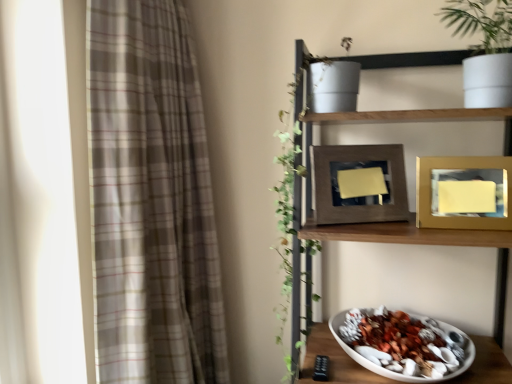
Question: From a real-world perspective, is plaid fabric curtain at left below wooden shelf at upper right?

Choices:
 (A) no
 (B) yes

Answer: (A)

Question: Is wooden shelf at upper right located within plaid fabric curtain at left?

Choices:
 (A) yes
 (B) no

Answer: (B)

Question: From a real-world perspective, is plaid fabric curtain at left on top of wooden shelf at upper right?

Choices:
 (A) yes
 (B) no

Answer: (A)

Question: Considering the relative sizes of plaid fabric curtain at left and wooden shelf at upper right in the image provided, is plaid fabric curtain at left smaller than wooden shelf at upper right?

Choices:
 (A) yes
 (B) no

Answer: (A)

Question: Is plaid fabric curtain at left placed right next to wooden shelf at upper right?

Choices:
 (A) yes
 (B) no

Answer: (B)

Question: Is point (422, 324) positioned closer to the camera than point (434, 205)?

Choices:
 (A) closer
 (B) farther

Answer: (B)

Question: Is white matte bowl at lower right inside the boundaries of gold metallic picture frame at upper right, which is the second picture frame in left-to-right order, or outside?

Choices:
 (A) inside
 (B) outside

Answer: (B)

Question: Considering the positions of white matte bowl at lower right and gold metallic picture frame at upper right, which is the second picture frame in left-to-right order, in the image, is white matte bowl at lower right taller or shorter than gold metallic picture frame at upper right, which is the second picture frame in left-to-right order,?

Choices:
 (A) tall
 (B) short

Answer: (B)

Question: In the image, is white matte bowl at lower right positioned in front of or behind gold metallic picture frame at upper right, which ranks as the 1th picture frame in right-to-left order?

Choices:
 (A) front
 (B) behind

Answer: (A)

Question: Based on their sizes in the image, would you say plaid fabric curtain at left is bigger or smaller than wooden frame at center, which ranks as the first picture frame in left-to-right order?

Choices:
 (A) small
 (B) big

Answer: (B)

Question: Would you say plaid fabric curtain at left is to the left or to the right of wooden frame at center, arranged as the second picture frame when viewed from the right, in the picture?

Choices:
 (A) left
 (B) right

Answer: (A)

Question: Looking at their shapes, would you say plaid fabric curtain at left is wider or thinner than wooden frame at center, arranged as the second picture frame when viewed from the right?

Choices:
 (A) thin
 (B) wide

Answer: (B)

Question: In terms of height, does plaid fabric curtain at left look taller or shorter compared to wooden frame at center, which ranks as the first picture frame in left-to-right order?

Choices:
 (A) short
 (B) tall

Answer: (B)

Question: Considering the positions of wooden frame at center, which ranks as the first picture frame in left-to-right order, and plaid fabric curtain at left in the image, is wooden frame at center, which ranks as the first picture frame in left-to-right order, bigger or smaller than plaid fabric curtain at left?

Choices:
 (A) small
 (B) big

Answer: (A)

Question: From a real-world perspective, is wooden frame at center, which ranks as the first picture frame in left-to-right order, positioned above or below plaid fabric curtain at left?

Choices:
 (A) above
 (B) below

Answer: (A)